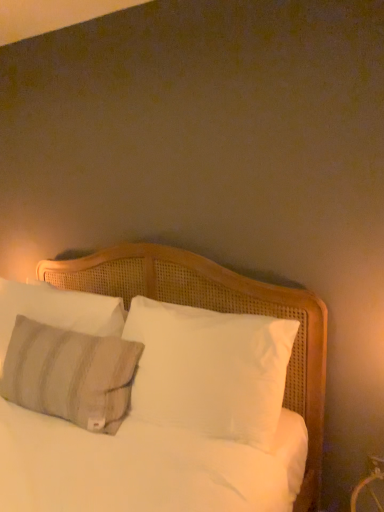
Question: Should I look upward or downward to see white woven bed at center?

Choices:
 (A) up
 (B) down

Answer: (B)

Question: Considering the relative sizes of white woven bed at center and textured gray pillow at left, the 1th pillow from the front, in the image provided, is white woven bed at center taller than textured gray pillow at left, the 1th pillow from the front,?

Choices:
 (A) yes
 (B) no

Answer: (A)

Question: Can you see white woven bed at center touching textured gray pillow at left, the 1th pillow from the front?

Choices:
 (A) no
 (B) yes

Answer: (A)

Question: Is white woven bed at center at the left side of textured gray pillow at left, the 1th pillow from the front?

Choices:
 (A) yes
 (B) no

Answer: (B)

Question: Does white woven bed at center have a smaller size compared to textured gray pillow at left, marked as the second pillow in a back-to-front arrangement?

Choices:
 (A) no
 (B) yes

Answer: (A)

Question: Could you tell me if white woven bed at center is facing textured gray pillow at left, the 1th pillow from the front?

Choices:
 (A) no
 (B) yes

Answer: (A)

Question: Would you say white woven bed at center is a long distance from textured gray pillow at left, marked as the second pillow in a back-to-front arrangement?

Choices:
 (A) no
 (B) yes

Answer: (A)

Question: Is textured gray pillow at left, the 1th pillow from the front, thinner than white woven bed at center?

Choices:
 (A) no
 (B) yes

Answer: (B)

Question: Does textured gray pillow at left, the 1th pillow from the front, appear on the left side of white woven bed at center?

Choices:
 (A) no
 (B) yes

Answer: (B)

Question: Is textured gray pillow at left, the 1th pillow from the front, placed right next to white woven bed at center?

Choices:
 (A) yes
 (B) no

Answer: (B)

Question: Is textured gray pillow at left, the 1th pillow from the front, surrounding white woven bed at center?

Choices:
 (A) no
 (B) yes

Answer: (A)

Question: From a real-world perspective, is textured gray pillow at left, the 1th pillow from the front, located higher than white woven bed at center?

Choices:
 (A) no
 (B) yes

Answer: (A)

Question: Is textured gray pillow at left, marked as the second pillow in a back-to-front arrangement, bigger than white woven bed at center?

Choices:
 (A) no
 (B) yes

Answer: (A)

Question: Is textured gray pillow at left, which is counted as the second pillow, starting from the front, taller than textured gray pillow at left, the 1th pillow from the front?

Choices:
 (A) yes
 (B) no

Answer: (B)